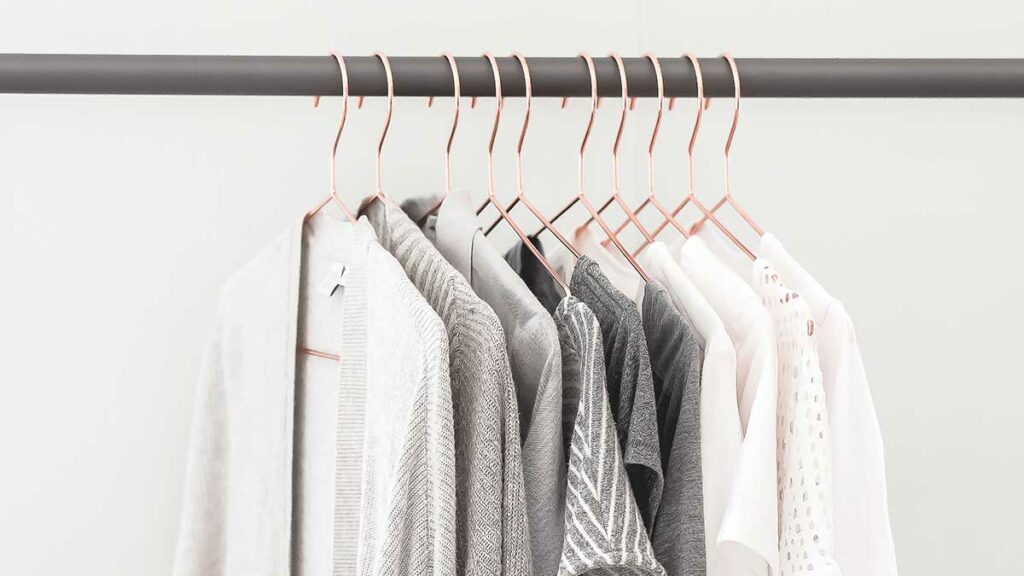
Where is `coat hangers`? coat hangers is located at coordinates (331, 165), (375, 172), (449, 172), (489, 149), (521, 158), (579, 166), (609, 170), (655, 168), (688, 172), (731, 172).